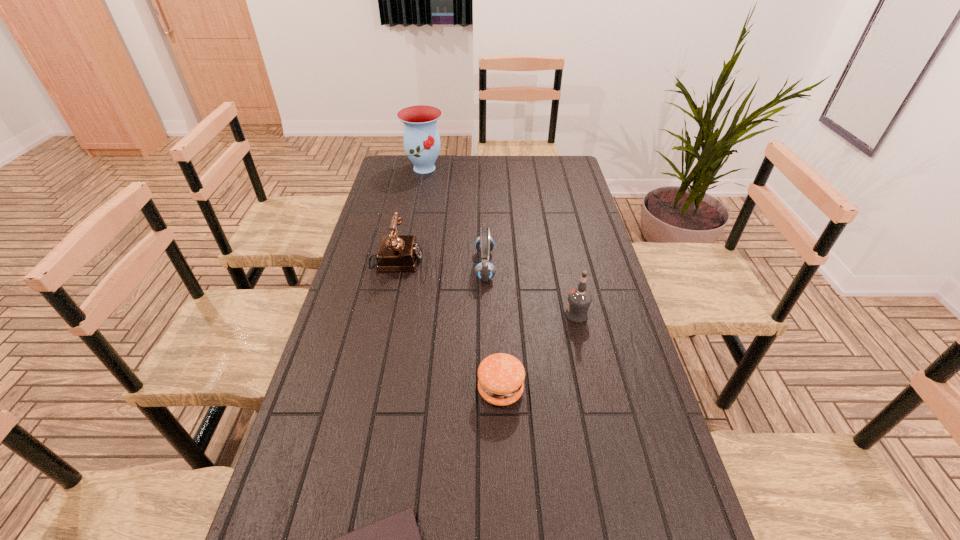
Find the location of `object at the right edge`. object at the right edge is located at coordinates (579, 299).

I want to click on object that is at the far left corner, so click(x=421, y=139).

Find the location of a particular element. This screenshot has width=960, height=540. vacant space at the far edge of the desktop is located at coordinates (463, 168).

Where is `free space at the left edge of the desktop`? The image size is (960, 540). free space at the left edge of the desktop is located at coordinates (344, 431).

At what (x,y) coordinates should I click in order to perform the action: click on vacant space at the right edge of the desktop. Please return your answer as a coordinate pair (x, y). The width and height of the screenshot is (960, 540). Looking at the image, I should click on (619, 310).

In the image, there is a desktop. At what (x,y) coordinates should I click in order to perform the action: click on free space at the far right corner. Please return your answer as a coordinate pair (x, y). The width and height of the screenshot is (960, 540). Looking at the image, I should click on (555, 161).

At what (x,y) coordinates should I click in order to perform the action: click on vacant area that lies between the fourth farthest object and the telephone. Please return your answer as a coordinate pair (x, y). The width and height of the screenshot is (960, 540). Looking at the image, I should click on (486, 289).

Image resolution: width=960 pixels, height=540 pixels. In order to click on vacant space that is in between the headset and the fifth farthest object in this screenshot , I will do `click(492, 328)`.

Identify the location of vacant region between the farthest object and the third nearest object. pos(500,242).

Find the location of `vacant space in between the telephone and the second shortest object`. vacant space in between the telephone and the second shortest object is located at coordinates (448, 326).